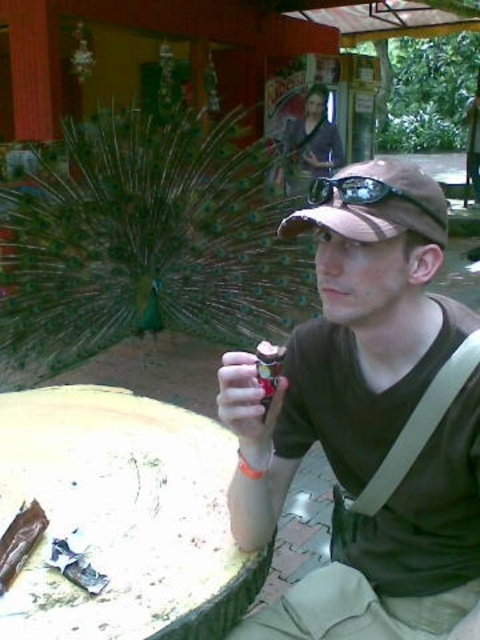
You are a photographer trying to capture the man and the peacock in the same frame. The man is wearing a brown T shirt at center. You need to place a focus point at point [369,419]. Will this point be on the man or the peacock?

The point [369,419] is on the matte brown shirt at center, so the focus point will be on the man.

You are a fashion designer observing the man in the scene. You need to determine if the black rubber goggles at center can be worn over the matte brown shirt at center without any adjustments. Based on the size difference between them, what would you advise?

The matte brown shirt at center has a larger size compared to black rubber goggles at center. Since the shirt is larger, the goggles can be worn over it without any adjustments needed.

You are a photographer trying to capture a closeup of the black rubber goggles at center while the matte brown shirt at center is in the background. Can you focus on the goggles without the shirt blocking the view?

The matte brown shirt at center is much taller than the black rubber goggles at center, so the shirt would block the view of the goggles. You cannot focus on the goggles without the shirt blocking the view.